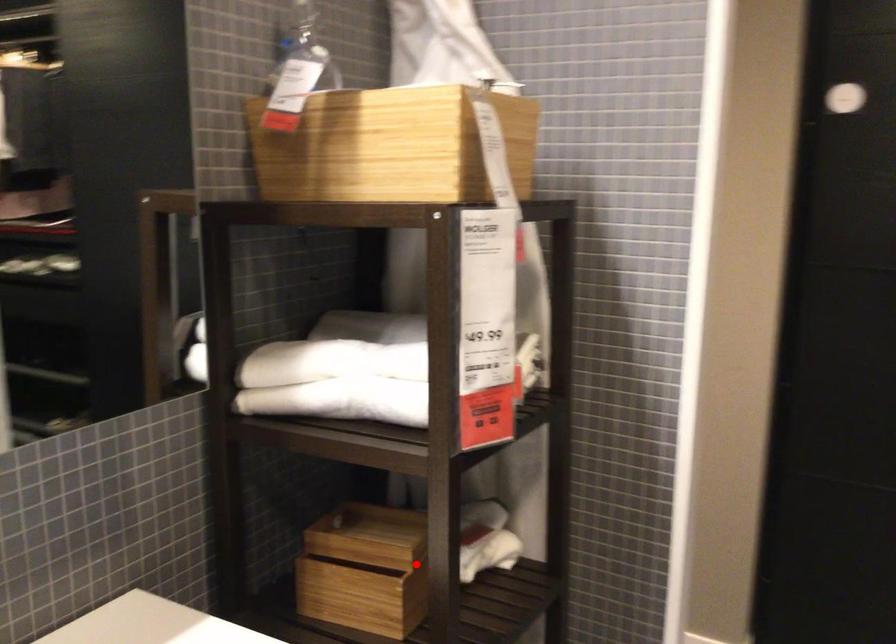
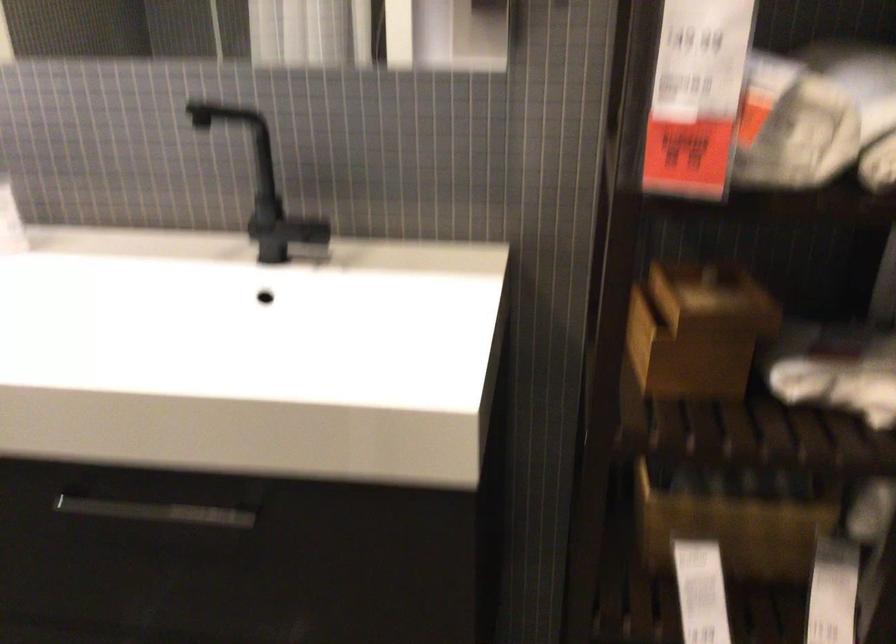
Find the pixel in the second image that matches the highlighted location in the first image.

(696, 330)